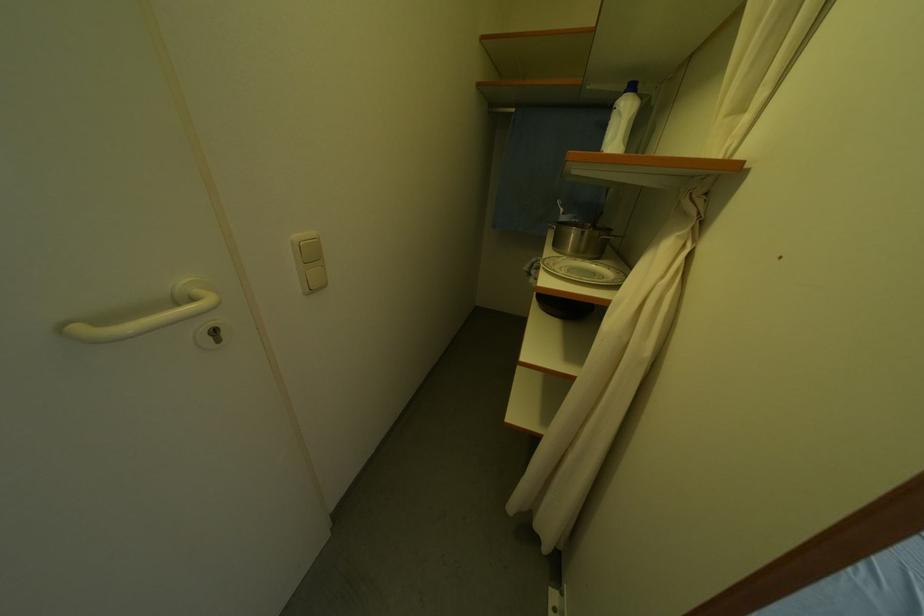
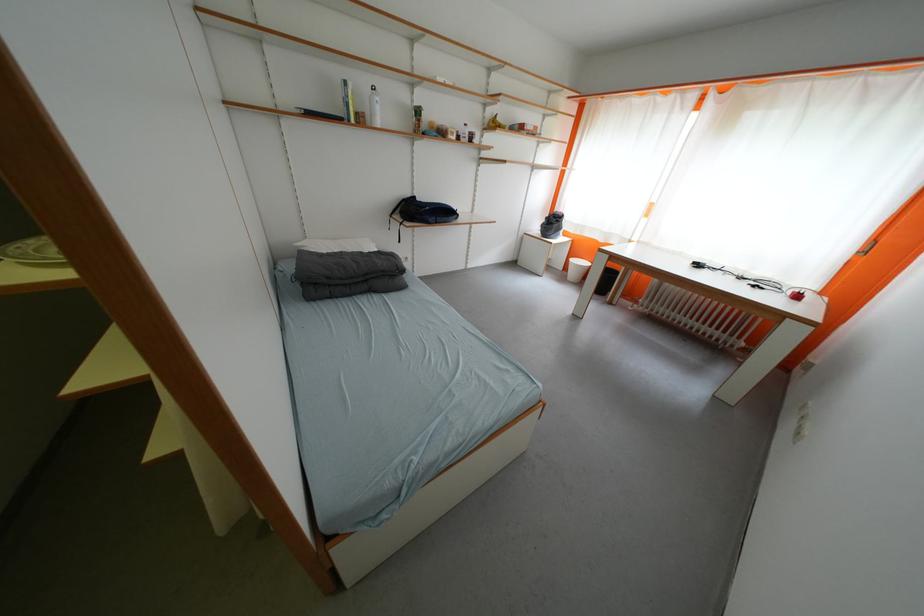
The first image is from the beginning of the video and the second image is from the end. How did the camera likely rotate when shooting the video?

The camera's rotation is toward right-down.